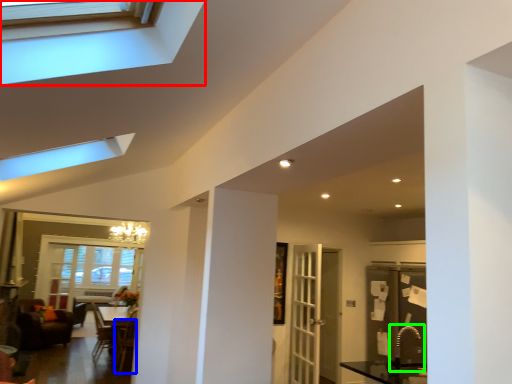
Question: Considering the real-world distances, which object is closest to window (highlighted by a red box)? armchair (highlighted by a blue box) or sink (highlighted by a green box).

Choices:
 (A) armchair
 (B) sink

Answer: (A)